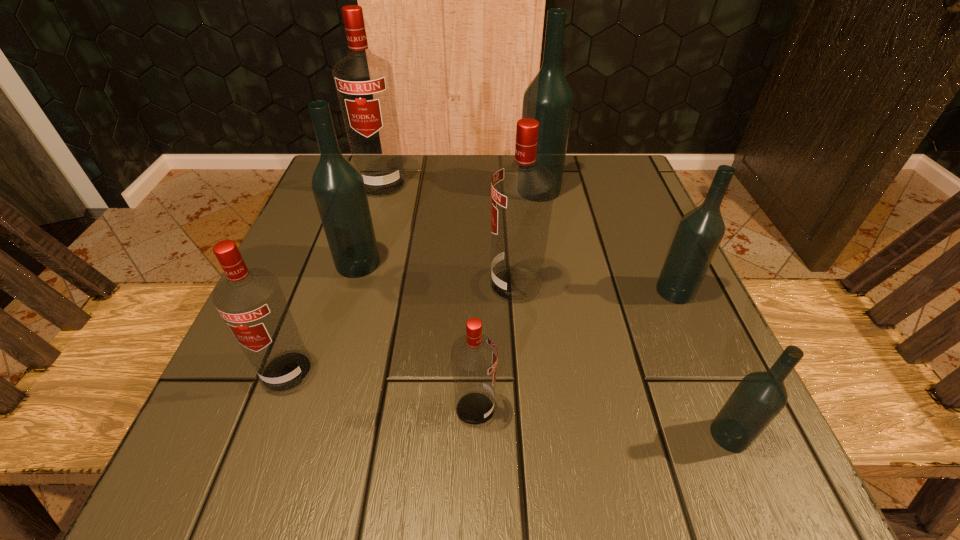
I want to click on free spot located 0.120m on the right of the biggest black vodka, so click(x=613, y=190).

Identify the location of free space located on the front label of the second biggest red vodka. The width and height of the screenshot is (960, 540). (393, 285).

Locate an element on the screen. This screenshot has height=540, width=960. free space located on the front label of the second biggest red vodka is located at coordinates (398, 285).

This screenshot has height=540, width=960. Identify the location of vacant space situated on the front label of the second biggest red vodka. (416, 285).

You are a GUI agent. You are given a task and a screenshot of the screen. Output one action in this format:
    pyautogui.click(x=<x>, y=<y>)
    Task: Click on the vacant space situated on the back of the leftmost black vodka
    The image size is (960, 540).
    Given the screenshot: What is the action you would take?
    pyautogui.click(x=389, y=160)

Locate an element on the screen. This screenshot has width=960, height=540. free space located 0.190m on the left of the second smallest black vodka is located at coordinates (547, 291).

Where is `vacant space located on the front label of the third biggest red vodka`? vacant space located on the front label of the third biggest red vodka is located at coordinates (266, 427).

This screenshot has width=960, height=540. In order to click on vacant point located on the front label of the smallest red vodka in this screenshot , I will do `click(532, 409)`.

At what (x,y) coordinates should I click in order to perform the action: click on free location located on the left of the nearest black vodka. Please return your answer as a coordinate pair (x, y). The width and height of the screenshot is (960, 540). Looking at the image, I should click on (505, 435).

The height and width of the screenshot is (540, 960). I want to click on object that is at the near edge, so click(x=760, y=396).